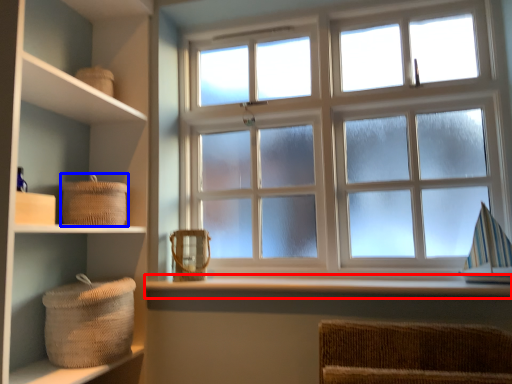
Question: Which object appears farthest to the camera in this image, window sill (highlighted by a red box) or basket (highlighted by a blue box)?

Choices:
 (A) window sill
 (B) basket

Answer: (B)